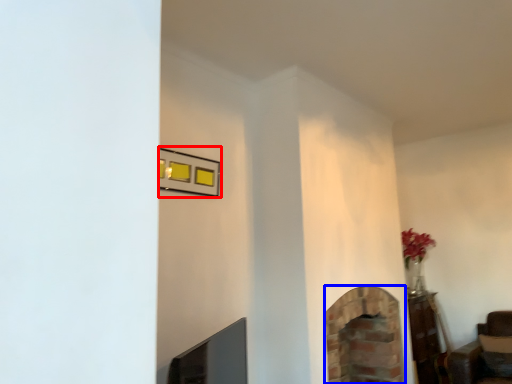
Question: Which point is further to the camera, picture frame (highlighted by a red box) or fireplace (highlighted by a blue box)?

Choices:
 (A) picture frame
 (B) fireplace

Answer: (B)